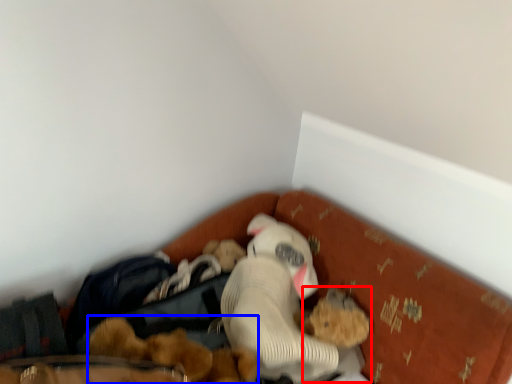
Question: Which object appears farthest to the camera in this image, toy (highlighted by a red box) or toy (highlighted by a blue box)?

Choices:
 (A) toy
 (B) toy

Answer: (A)